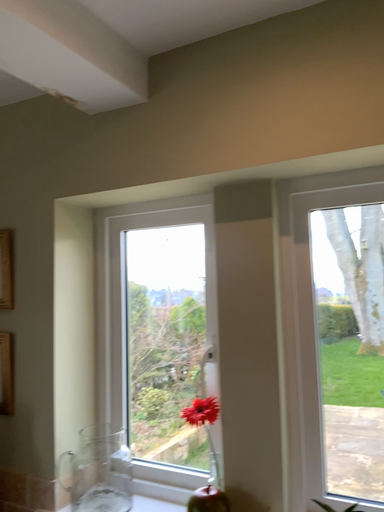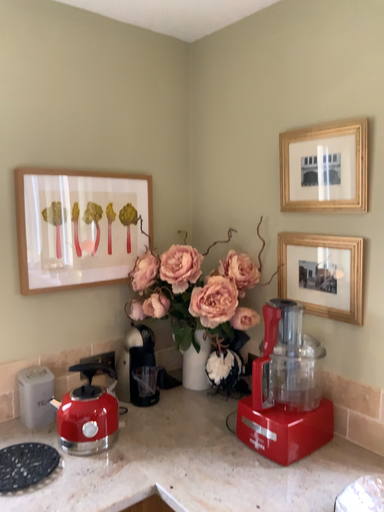
Question: Which way did the camera rotate in the video?

Choices:
 (A) rotated right
 (B) rotated left

Answer: (B)